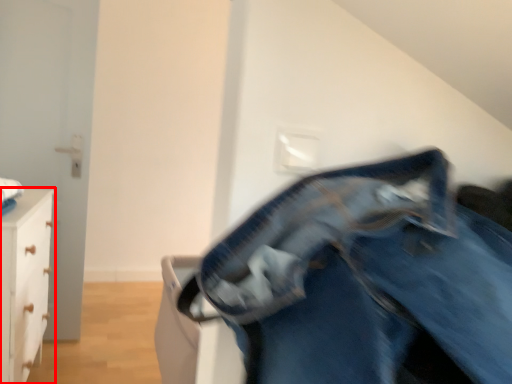
Question: From the image's perspective, what is the correct spatial positioning of chest of drawers (annotated by the red box) in reference to trousers?

Choices:
 (A) above
 (B) below

Answer: (B)